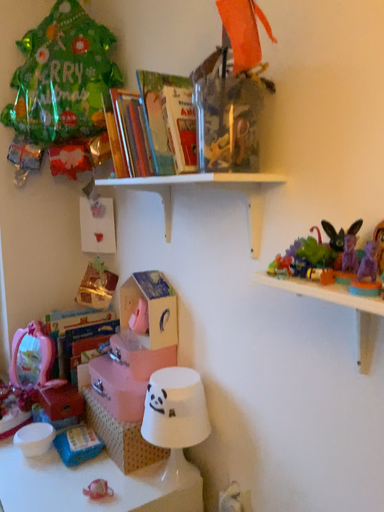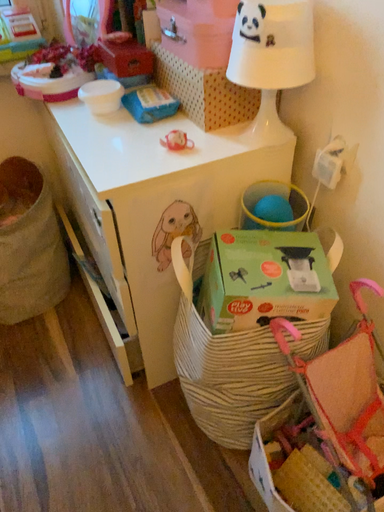
Question: Which way did the camera rotate in the video?

Choices:
 (A) rotated right
 (B) rotated left

Answer: (B)